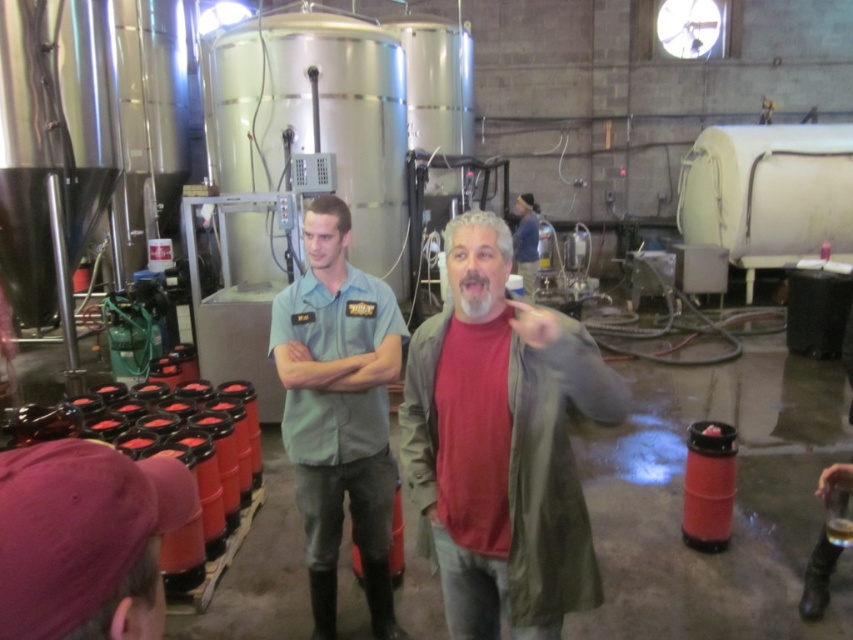
Question: Is pink fabric cap at lower left smaller than blue denim jacket at center?

Choices:
 (A) no
 (B) yes

Answer: (B)

Question: Which point is farther to the camera?

Choices:
 (A) (357, 314)
 (B) (512, 246)
 (C) (457, 264)
 (D) (131, 524)

Answer: (B)

Question: Does red matte jacket at center have a larger size compared to pink fabric cap at lower left?

Choices:
 (A) yes
 (B) no

Answer: (A)

Question: Is red matte jacket at center thinner than blue denim jacket at center?

Choices:
 (A) no
 (B) yes

Answer: (A)

Question: Which point is closer to the camera taking this photo?

Choices:
 (A) (299, 298)
 (B) (96, 579)

Answer: (B)

Question: Which object is farther from the camera taking this photo?

Choices:
 (A) matte blue shirt at center
 (B) red matte jacket at center
 (C) pink fabric cap at lower left

Answer: (A)